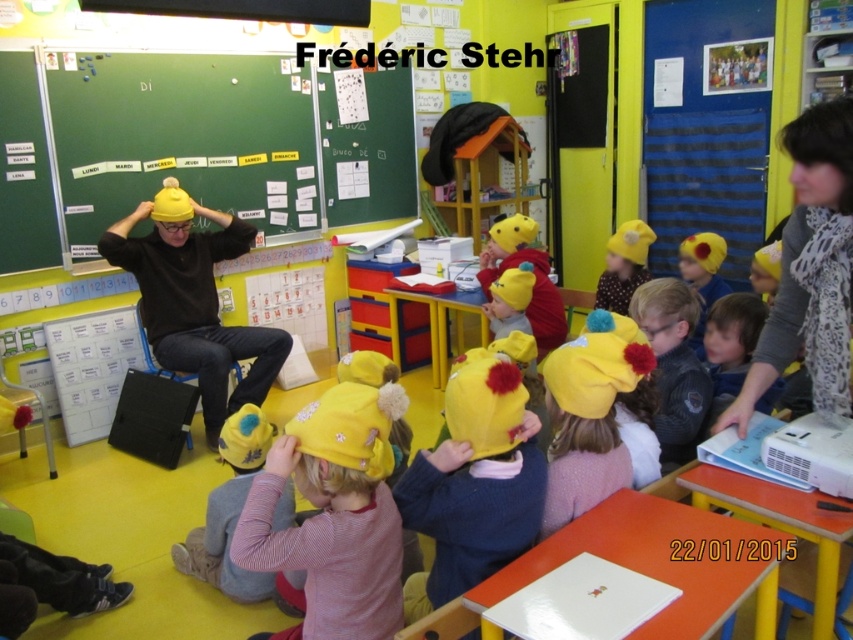
Question: Which point appears closest to the camera in this image?

Choices:
 (A) (332, 552)
 (B) (525, 522)
 (C) (177, 352)
 (D) (288, 220)

Answer: (A)

Question: Which of these objects is positioned farthest from the matte yellow bulletin board at upper left?

Choices:
 (A) yellow fuzzy hat at lower center
 (B) yellow fuzzy hat at center

Answer: (B)

Question: Can you confirm if matte yellow bulletin board at upper left is thinner than matte yellow hat at center?

Choices:
 (A) yes
 (B) no

Answer: (B)

Question: Is matte yellow bulletin board at upper left to the left of matte yellow hat at center from the viewer's perspective?

Choices:
 (A) no
 (B) yes

Answer: (A)

Question: Considering the real-world distances, which object is farthest from the matte yellow hat at center?

Choices:
 (A) matte yellow bulletin board at upper left
 (B) yellow fuzzy hat at lower center

Answer: (B)

Question: Can you confirm if yellow fuzzy hat at center is bigger than matte yellow hat at center?

Choices:
 (A) no
 (B) yes

Answer: (A)